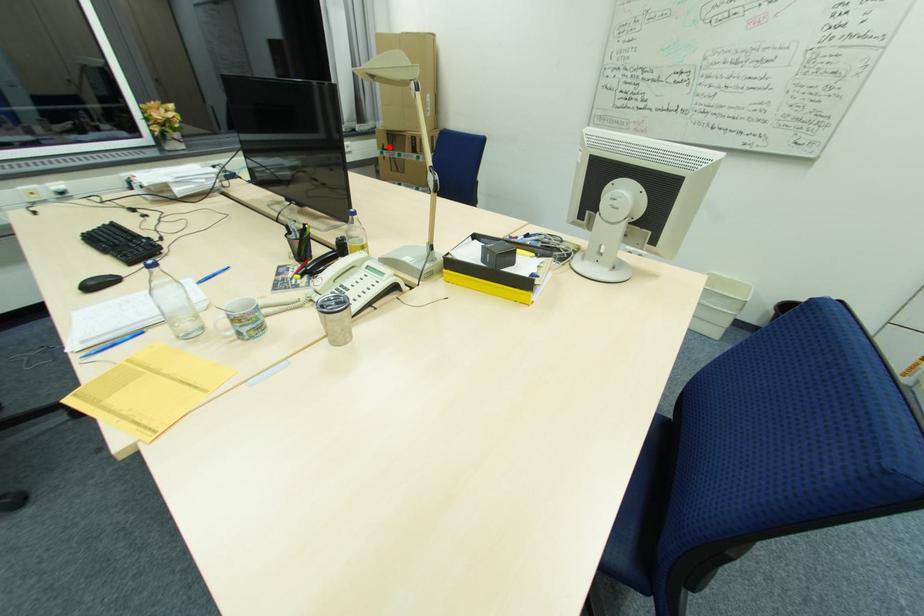
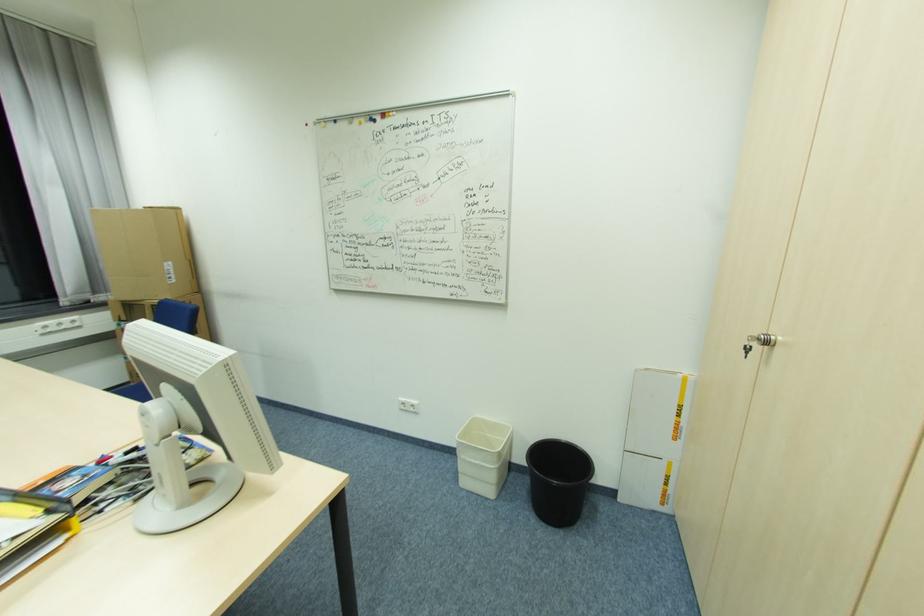
Question: I am providing you with two images of the same scene from different viewpoints. A red point is shown in image1. For the corresponding object point in image2, is it positioned nearer or farther from the camera?

Choices:
 (A) Nearer
 (B) Farther

Answer: (B)